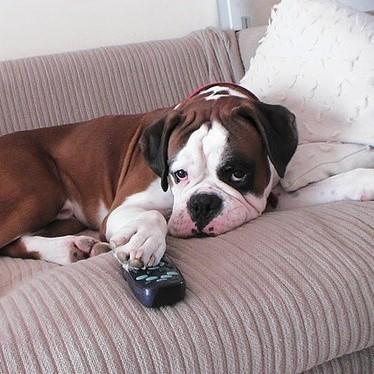
Locate an element on the screen. This screenshot has width=374, height=374. open grey wall space, top edge is located at coordinates (172, 19), (48, 25).